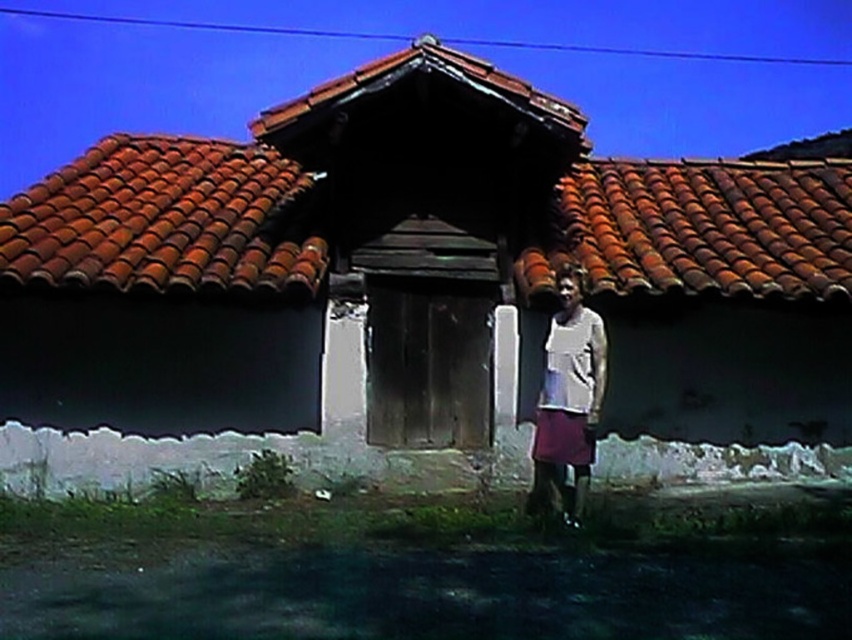
From the picture: Looking at the rustic building, where is the brown tile roof at center in relation to the terracotta tiles at center?

The brown tile roof at center is to the left of the terracotta tiles at center.

You are standing in front of the rustic building and notice two items in the scene. One is the terracotta tiles at center and the other is the white matte shirt at right. Which of these two items is larger in size?

The terracotta tiles at center is bigger than the white matte shirt at right, so the terracotta tiles at center is larger in size.